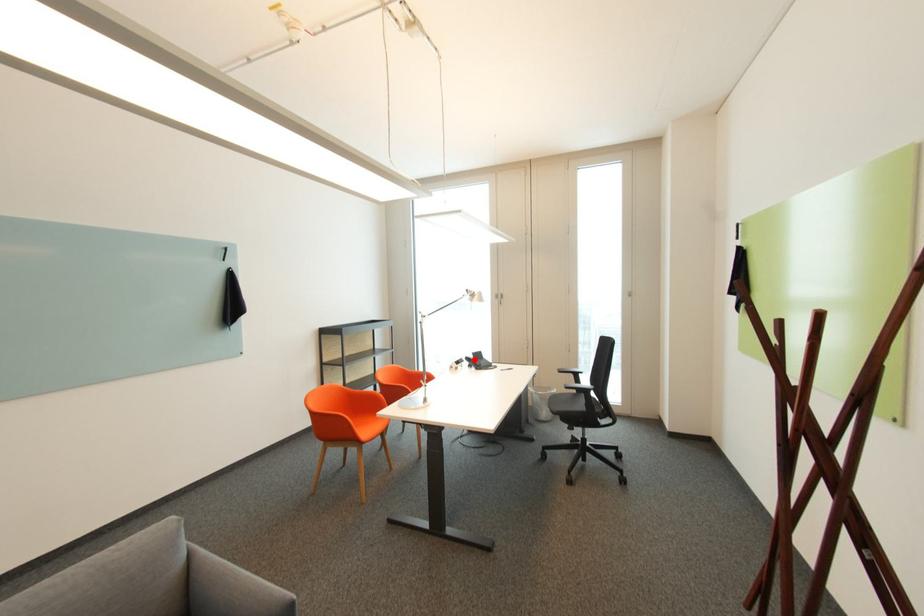
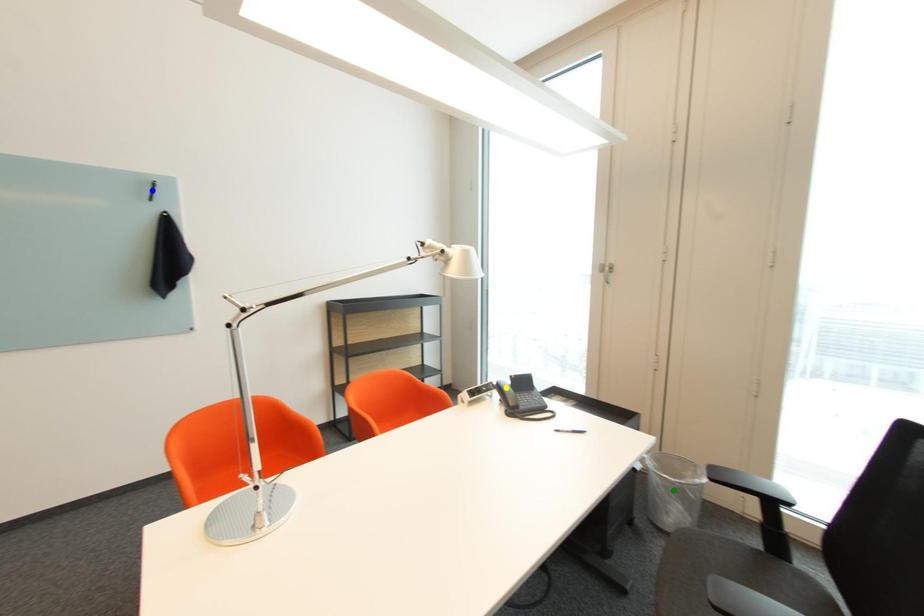
Question: I am providing you with two images of the same scene from different viewpoints. A red point is marked on the first image. You are given multiple points on the second image. Can you choose the point in image 2 that corresponds to the point in image 1?

Choices:
 (A) yellow point
 (B) green point
 (C) blue point

Answer: (A)